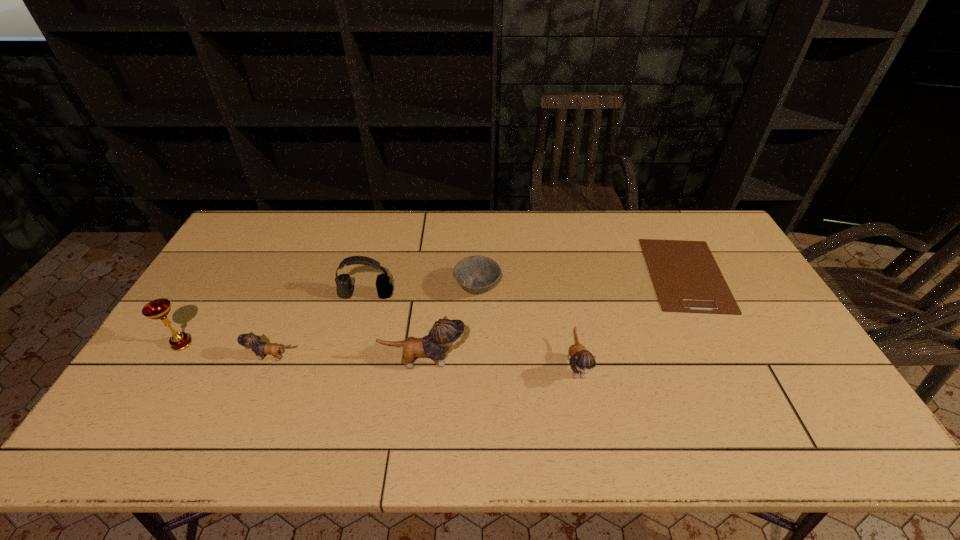
At what (x,y) coordinates should I click in order to perform the action: click on object that is positioned at the left edge. Please return your answer as a coordinate pair (x, y). The height and width of the screenshot is (540, 960). Looking at the image, I should click on (159, 308).

Identify the location of object present at the right edge. (687, 279).

Where is `object located in the far right corner section of the desktop`? Image resolution: width=960 pixels, height=540 pixels. object located in the far right corner section of the desktop is located at coordinates (687, 279).

You are a GUI agent. You are given a task and a screenshot of the screen. Output one action in this format:
    pyautogui.click(x=<x>, y=<y>)
    Task: Click on the free location at the far edge of the desktop
    
    Given the screenshot: What is the action you would take?
    pyautogui.click(x=464, y=212)

Locate an element on the screen. The width and height of the screenshot is (960, 540). vacant space at the near edge of the desktop is located at coordinates (716, 400).

Find the location of a particular element. This screenshot has width=960, height=540. vacant space at the left edge is located at coordinates (223, 316).

You are a GUI agent. You are given a task and a screenshot of the screen. Output one action in this format:
    pyautogui.click(x=<x>, y=<y>)
    Task: Click on the free region at the far right corner
    Image resolution: width=960 pixels, height=540 pixels.
    Given the screenshot: What is the action you would take?
    pyautogui.click(x=699, y=240)

Image resolution: width=960 pixels, height=540 pixels. What are the coordinates of `vacant area that lies between the chalice and the shortest object` in the screenshot? It's located at (434, 309).

The width and height of the screenshot is (960, 540). What are the coordinates of `vacant space that is in between the second tallest kitten and the tallest kitten` in the screenshot? It's located at (500, 363).

Where is `vacant point located between the leftmost object and the second tallest kitten`? This screenshot has width=960, height=540. vacant point located between the leftmost object and the second tallest kitten is located at coordinates (379, 355).